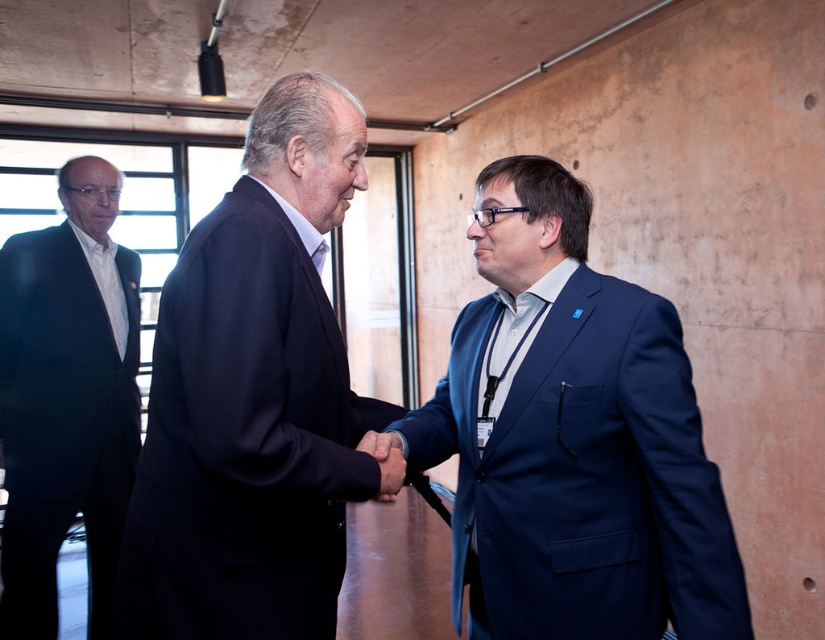
Between dark blue suit at center and black suit at left, which one has more height?

With more height is black suit at left.

Is point (260, 122) more distant than point (50, 506)?

No, (260, 122) is closer to viewer.

What do you see at coordinates (255, 397) in the screenshot? I see `dark blue suit at center` at bounding box center [255, 397].

Locate an element on the screen. This screenshot has height=640, width=825. dark blue suit at center is located at coordinates (255, 397).

Is blue fabric suit at center above dark blue suit at center?

Incorrect, blue fabric suit at center is not positioned above dark blue suit at center.

Is blue fabric suit at center smaller than dark blue suit at center?

No.

Is point (503, 598) positioned before point (380, 488)?

No, it is not.

Locate an element on the screen. blue fabric suit at center is located at coordinates (573, 438).

Which of these two, blue fabric suit at center or black suit at left, stands shorter?

blue fabric suit at center

Consider the image. Is blue fabric suit at center below black suit at left?

No, blue fabric suit at center is not below black suit at left.

Is point (543, 312) closer to viewer compared to point (52, 572)?

Yes.

Where is `blue fabric suit at center`? The height and width of the screenshot is (640, 825). blue fabric suit at center is located at coordinates (573, 438).